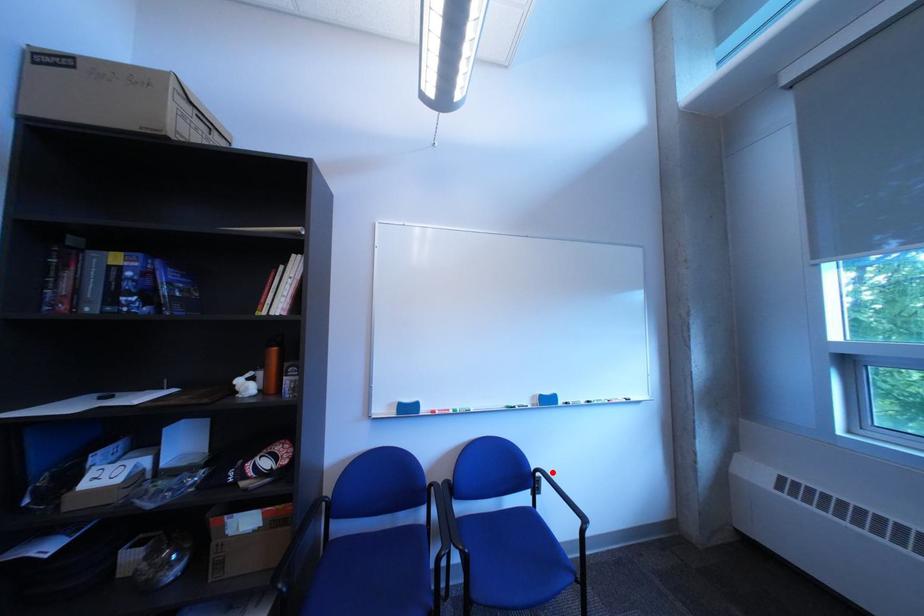
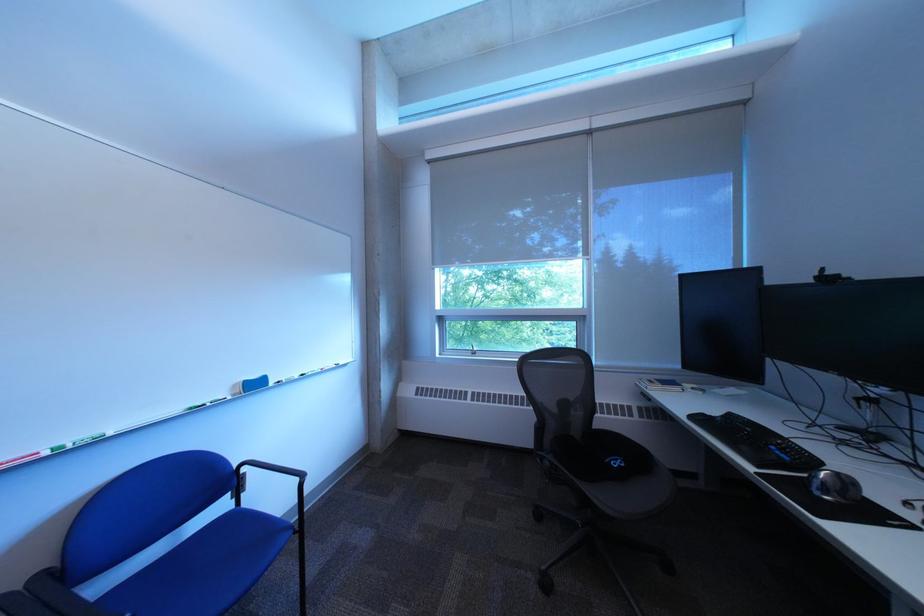
In the second image, find the point that corresponds to the highlighted location in the first image.

(257, 467)